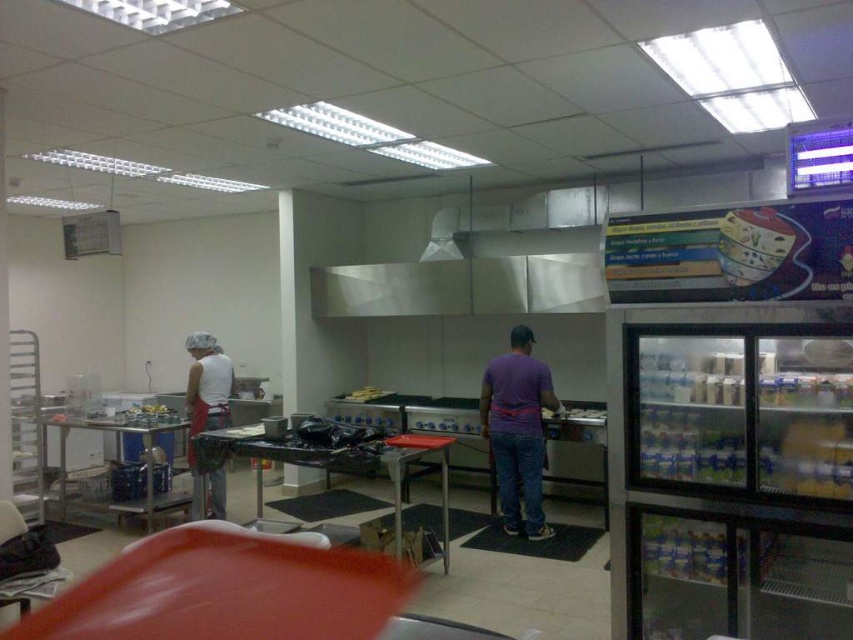
You are standing in the commercial kitchen described. Where exactly is the white matte apron at left located in terms of coordinates?

The white matte apron at left is located at coordinates point (206, 396).

You are a new employee in the kitchen and need to hang your white matte apron at left. The hook for the apron is located near the stainless steel exhaust hood at upper center. Can you reach the hook if you stand on the floor?

The white matte apron at left is much taller than the stainless steel exhaust hood at upper center, so the apron is likely out of reach if you stand on the floor. You may need a step stool to reach the hook near the stainless steel exhaust hood at upper center.